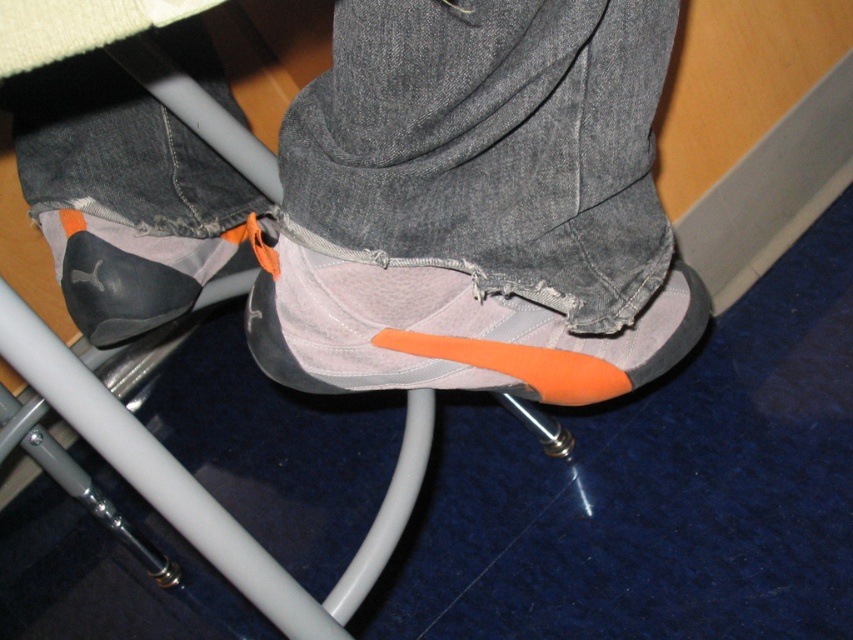
Can you confirm if matte gray shoe at center is positioned to the left of gray fabric shoe at center?

Yes, matte gray shoe at center is to the left of gray fabric shoe at center.

Which of these two, matte gray shoe at center or gray fabric shoe at center, stands shorter?

With less height is gray fabric shoe at center.

Image resolution: width=853 pixels, height=640 pixels. Find the location of `matte gray shoe at center`. matte gray shoe at center is located at coordinates (393, 204).

In the scene shown: Is gray fabric shoe at center smaller than matte black sneaker at lower center?

Actually, gray fabric shoe at center might be larger than matte black sneaker at lower center.

Based on the photo, is gray fabric shoe at center to the left of matte black sneaker at lower center from the viewer's perspective?

In fact, gray fabric shoe at center is to the right of matte black sneaker at lower center.

Locate an element on the screen. The width and height of the screenshot is (853, 640). gray fabric shoe at center is located at coordinates (448, 332).

Between matte gray shoe at center and matte black sneaker at lower center, which one appears on the right side from the viewer's perspective?

Positioned to the right is matte gray shoe at center.

Looking at this image, can you confirm if matte gray shoe at center is positioned below matte black sneaker at lower center?

No.

Describe the element at coordinates (393, 204) in the screenshot. I see `matte gray shoe at center` at that location.

Locate an element on the screen. Image resolution: width=853 pixels, height=640 pixels. matte gray shoe at center is located at coordinates (393, 204).